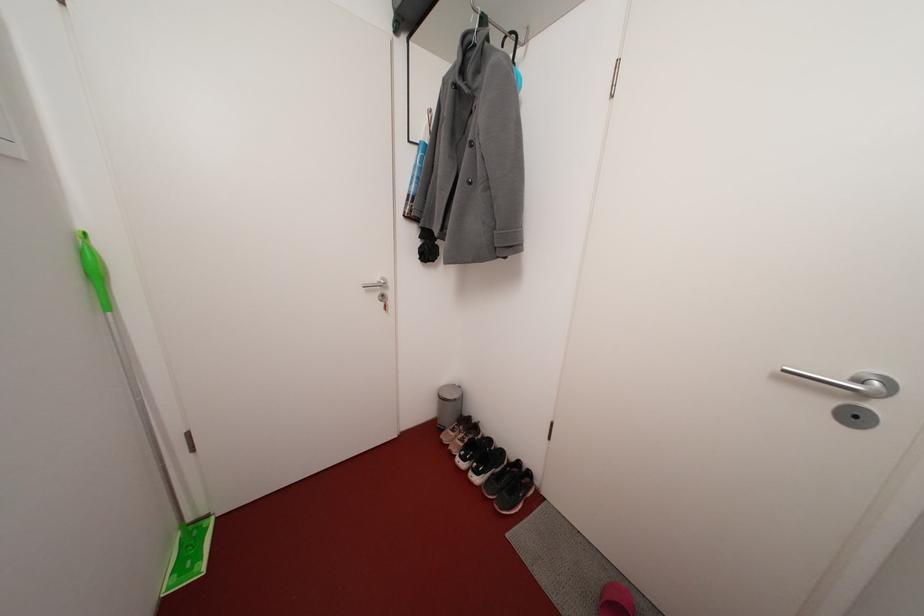
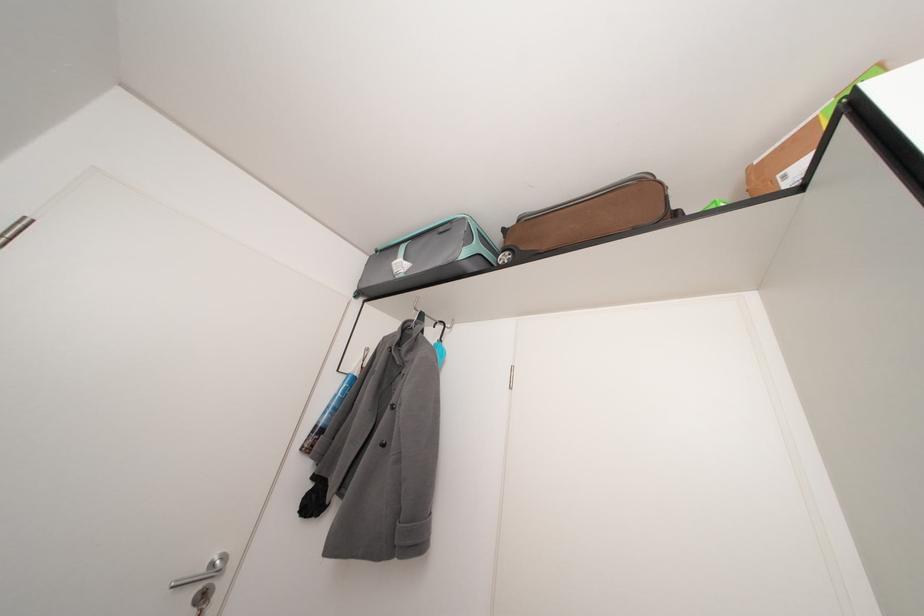
The point at (385, 299) is marked in the first image. Where is the corresponding point in the second image?

(208, 592)